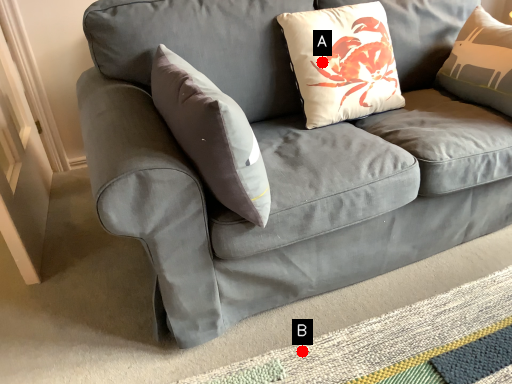
Question: Two points are circled on the image, labeled by A and B beside each circle. Which point is closer to the camera?

Choices:
 (A) A is closer
 (B) B is closer

Answer: (B)